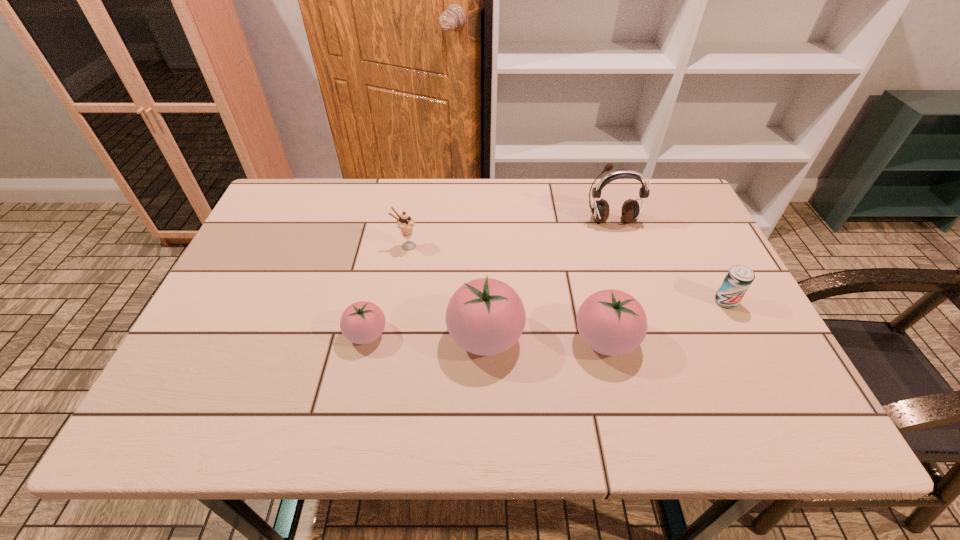
With all tomatos evenly spaced, where should an extra tomato be placed on the right to continue the pattern? Please point out a vacant space. Please provide its 2D coordinates. Your answer should be formatted as a tuple, i.e. [(x, y)], where the tuple contains the x and y coordinates of a point satisfying the conditions above.

[(728, 342)]